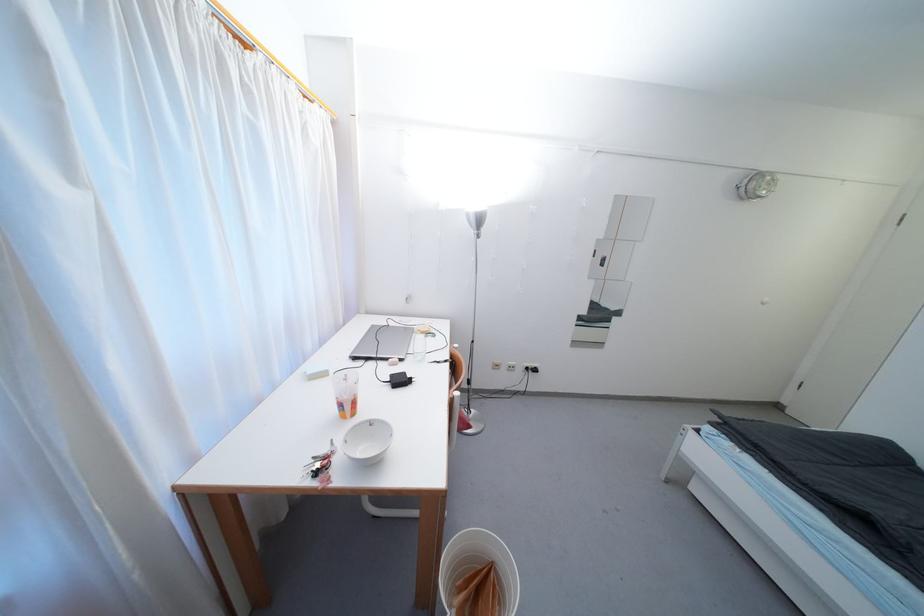
At what (x,y) coordinates should I click in order to perform the action: click on small pink case. Please return your answer as a coordinate pair (x, y). Looking at the image, I should click on (478, 570).